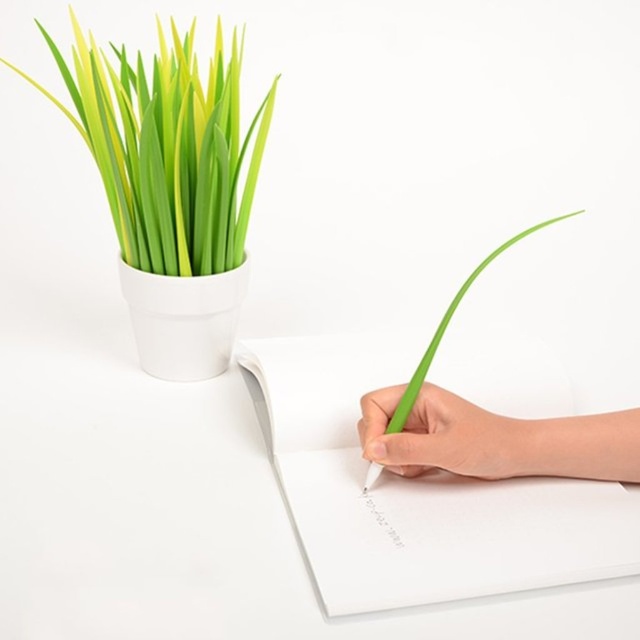
You are an artist trying to sketch the scene. You need to decide which object to draw first based on their sizes. Which object should you focus on first, the green matte grass at upper left or the green matte pen at lower right?

The green matte grass at upper left should be focused on first because its width is larger than the green matte pen at lower right, making it a more prominent feature in the scene.

You are an artist who needs to place a 12 inch ruler between the green matte grass at upper left and the green matte pen at lower right. Can the ruler fit horizontally between them without overlapping either object?

The distance between the green matte grass at upper left and the green matte pen at lower right is 11.56 inches. Since the ruler is 12 inches long, it cannot fit horizontally between them without overlapping either object.

You are organizing a desk and need to place the white paper at center and the green matte grass at upper left. Which object requires more space due to its larger size?

The green matte grass at upper left requires more space because it is larger than the white paper at center.